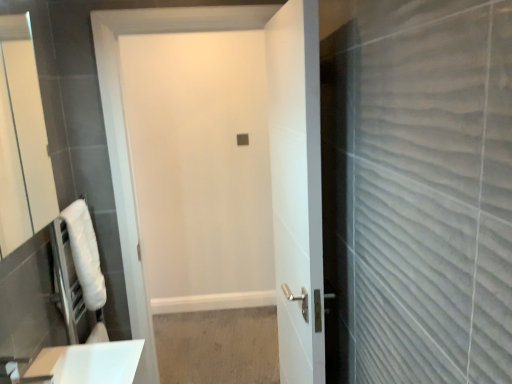
Question: Which direction should I rotate to look at white glossy door at center, which ranks as the 2th door in left-to-right order, — up or down?

Choices:
 (A) down
 (B) up

Answer: (A)

Question: Is matte white mirror at left taller than white glossy door at center, which ranks as the 2th door in left-to-right order?

Choices:
 (A) yes
 (B) no

Answer: (B)

Question: Are matte white mirror at left and white glossy door at center, which ranks as the 1th door in right-to-left order, located far from each other?

Choices:
 (A) no
 (B) yes

Answer: (B)

Question: Is matte white mirror at left facing away from white glossy door at center, which ranks as the 2th door in left-to-right order?

Choices:
 (A) no
 (B) yes

Answer: (A)

Question: Considering the relative sizes of matte white mirror at left and white glossy door at center, which ranks as the 2th door in left-to-right order, in the image provided, is matte white mirror at left smaller than white glossy door at center, which ranks as the 2th door in left-to-right order,?

Choices:
 (A) yes
 (B) no

Answer: (A)

Question: Is matte white mirror at left to the right of white glossy door at center, which ranks as the 2th door in left-to-right order, from the viewer's perspective?

Choices:
 (A) yes
 (B) no

Answer: (B)

Question: From the image's perspective, is matte white mirror at left under white glossy door at center, which ranks as the 2th door in left-to-right order?

Choices:
 (A) no
 (B) yes

Answer: (A)

Question: Is white towel at left behind white matte door at center, acting as the 2th door starting from the right?

Choices:
 (A) yes
 (B) no

Answer: (B)

Question: Can you confirm if white towel at left is bigger than white matte door at center, the first door in the left-to-right sequence?

Choices:
 (A) no
 (B) yes

Answer: (A)

Question: Is white matte door at center, the first door in the left-to-right sequence, at the back of white towel at left?

Choices:
 (A) no
 (B) yes

Answer: (A)

Question: Does white towel at left have a lesser width compared to white matte door at center, acting as the 2th door starting from the right?

Choices:
 (A) no
 (B) yes

Answer: (B)

Question: Considering the relative sizes of white towel at left and white matte door at center, acting as the 2th door starting from the right, in the image provided, is white towel at left wider than white matte door at center, acting as the 2th door starting from the right,?

Choices:
 (A) yes
 (B) no

Answer: (B)

Question: Is white towel at left completely or partially outside of white matte door at center, acting as the 2th door starting from the right?

Choices:
 (A) yes
 (B) no

Answer: (A)

Question: Considering the relative positions of matte white mirror at left and white matte door at center, acting as the 2th door starting from the right, in the image provided, is matte white mirror at left to the left of white matte door at center, acting as the 2th door starting from the right, from the viewer's perspective?

Choices:
 (A) no
 (B) yes

Answer: (B)